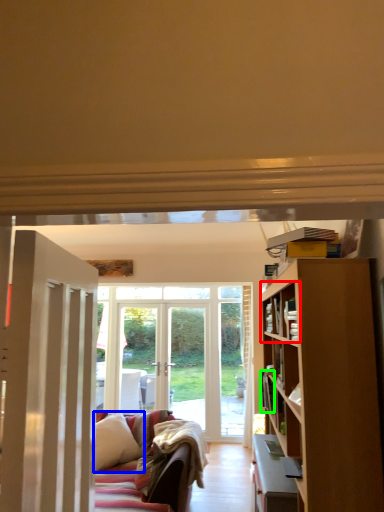
Question: Which is nearer to the shelf (highlighted by a red box)? pillow (highlighted by a blue box) or book (highlighted by a green box).

Choices:
 (A) pillow
 (B) book

Answer: (B)